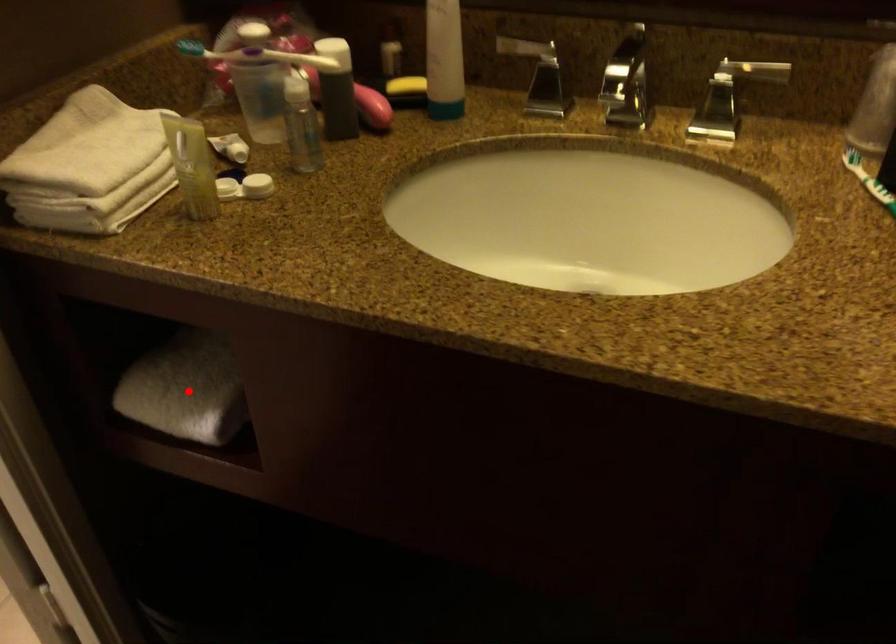
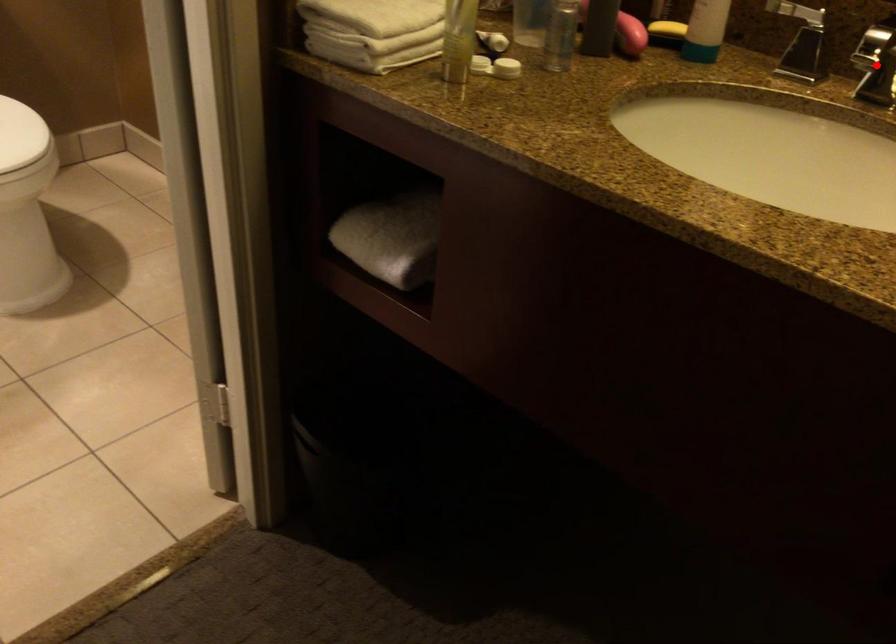
I am providing you with two images of the same scene from different viewpoints. A red point is marked on the first image and another point is marked on the second image. Is the marked point in image1 the same physical position as the marked point in image2?

No